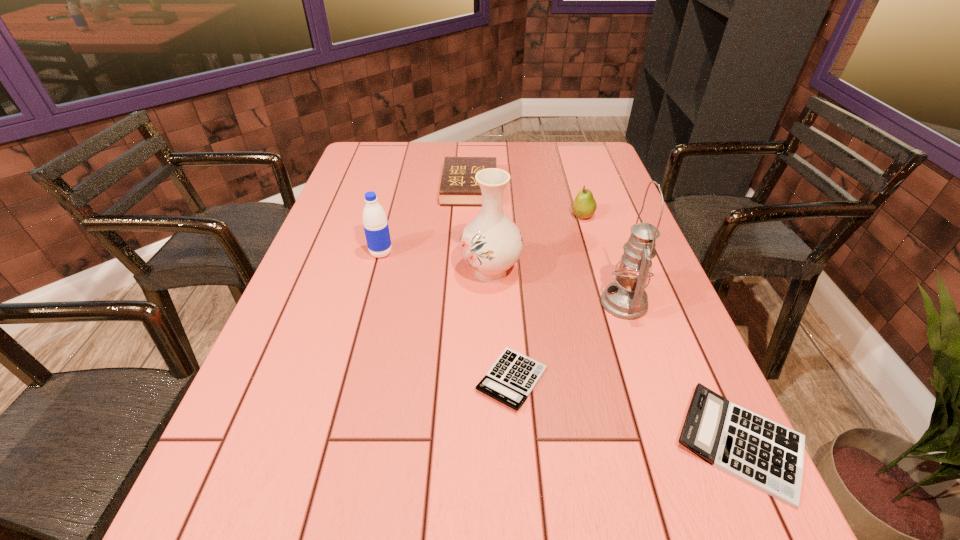
In the image, there is a desktop. At what (x,y) coordinates should I click in order to perform the action: click on vacant space at the far left corner. Please return your answer as a coordinate pair (x, y). This screenshot has height=540, width=960. Looking at the image, I should click on coord(370,148).

Locate an element on the screen. free point at the far right corner is located at coordinates (589, 163).

Where is `vacant area that lies between the sixth tallest object and the oil lamp`? The width and height of the screenshot is (960, 540). vacant area that lies between the sixth tallest object and the oil lamp is located at coordinates [x=682, y=373].

Find the location of a particular element. The width and height of the screenshot is (960, 540). free spot between the second tallest object and the oil lamp is located at coordinates (558, 287).

I want to click on vacant space that is in between the oil lamp and the sixth shortest object, so click(x=558, y=287).

This screenshot has height=540, width=960. I want to click on vacant area that lies between the vase and the taller calculator, so click(x=615, y=357).

At what (x,y) coordinates should I click in order to perform the action: click on vacant area that lies between the shorter calculator and the right calculator. Please return your answer as a coordinate pair (x, y). Image resolution: width=960 pixels, height=540 pixels. Looking at the image, I should click on (626, 411).

The width and height of the screenshot is (960, 540). In order to click on vacant space that is in between the second farthest object and the taller calculator in this screenshot , I will do `click(661, 330)`.

The height and width of the screenshot is (540, 960). What are the coordinates of `free spot between the vase and the oil lamp` in the screenshot? It's located at (558, 287).

Where is `vacant point located between the fifth tallest object and the pear`? vacant point located between the fifth tallest object and the pear is located at coordinates (526, 202).